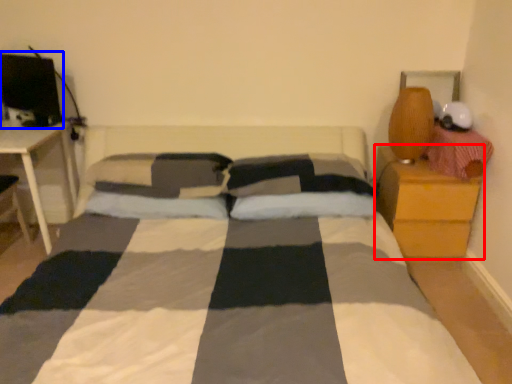
Question: Which object appears closest to the camera in this image, nightstand (highlighted by a red box) or computer monitor (highlighted by a blue box)?

Choices:
 (A) nightstand
 (B) computer monitor

Answer: (B)